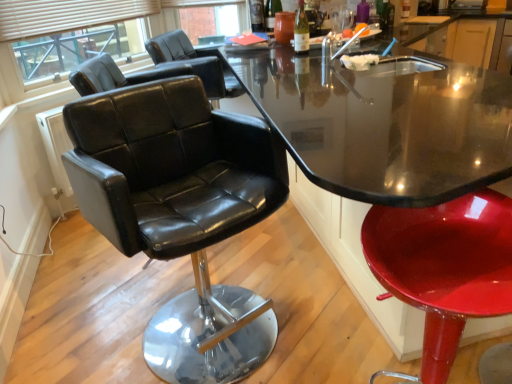
Image resolution: width=512 pixels, height=384 pixels. I want to click on glossy black table at center, so click(378, 148).

Locate an element on the screen. The image size is (512, 384). glossy red stool at lower right, which is counted as the third chair, starting from the back is located at coordinates (444, 267).

Locate an element on the screen. Image resolution: width=512 pixels, height=384 pixels. black leather chair at center, which ranks as the first chair in back-to-front order is located at coordinates (170, 47).

What do you see at coordinates (301, 30) in the screenshot? The width and height of the screenshot is (512, 384). I see `white glass bottle at upper center` at bounding box center [301, 30].

You are a GUI agent. You are given a task and a screenshot of the screen. Output one action in this format:
    pyautogui.click(x=<x>, y=<y>)
    Task: Click on the black leather chairs at upper left
    
    Given the screenshot: What is the action you would take?
    pyautogui.click(x=73, y=27)

At what (x,y) coordinates should I click in order to perform the action: click on glossy black table at center. Please return your answer as a coordinate pair (x, y). Looking at the image, I should click on (378, 148).

Locate an element on the screen. This screenshot has width=512, height=384. bay window above the black leather chair at center, which ranks as the first chair in back-to-front order (from the image's perspective) is located at coordinates (73, 27).

Is black leather chairs at upper left not close to black leather chair at center, which ranks as the first chair in back-to-front order?

No, black leather chairs at upper left is not far away from black leather chair at center, which ranks as the first chair in back-to-front order.

Is black leather chairs at upper left facing away from black leather chair at center, which ranks as the first chair in back-to-front order?

No.

Between point (6, 34) and point (165, 37), which one is positioned in front?

Positioned in front is point (6, 34).

Would you consider glossy black table at center to be distant from glossy red stool at lower right, the 1th chair when ordered from front to back?

Yes, glossy black table at center and glossy red stool at lower right, the 1th chair when ordered from front to back, are quite far apart.

Based on the photo, can you tell me how much glossy black table at center and glossy red stool at lower right, which is counted as the third chair, starting from the back, differ in facing direction?

They differ by 92.5 degrees in their facing directions.

Image resolution: width=512 pixels, height=384 pixels. Identify the location of table that is on the right side of glossy red stool at lower right, which is counted as the third chair, starting from the back. (378, 148).

Considering the relative positions of glossy black table at center and glossy red stool at lower right, which is counted as the third chair, starting from the back, in the image provided, is glossy black table at center to the left of glossy red stool at lower right, which is counted as the third chair, starting from the back, from the viewer's perspective?

No.

Is white glass bottle at upper center spatially inside glossy black table at center, or outside of it?

white glass bottle at upper center lies outside glossy black table at center.

Measure the distance from white glass bottle at upper center to glossy black table at center.

white glass bottle at upper center is 25.47 inches from glossy black table at center.

Is point (298, 2) closer to camera compared to point (337, 127)?

No.

How many degrees apart are the facing directions of black leather chair at center, placed as the third chair when sorted from front to back, and black leather chairs at upper left?

There is a 23.5-degree angle between the facing directions of black leather chair at center, placed as the third chair when sorted from front to back, and black leather chairs at upper left.

Considering the relative sizes of black leather chair at center, which ranks as the first chair in back-to-front order, and black leather chairs at upper left in the image provided, is black leather chair at center, which ranks as the first chair in back-to-front order, thinner than black leather chairs at upper left?

No, black leather chair at center, which ranks as the first chair in back-to-front order, is not thinner than black leather chairs at upper left.

Is black leather chairs at upper left at the back of black leather chair at center, which ranks as the first chair in back-to-front order?

Yes, black leather chair at center, which ranks as the first chair in back-to-front order, is positioned with its back facing black leather chairs at upper left.

From a real-world perspective, relative to black leather chairs at upper left, is black leather chair at center, which ranks as the first chair in back-to-front order, vertically above or below?

black leather chair at center, which ranks as the first chair in back-to-front order, is situated lower than black leather chairs at upper left in the real world.

Does black leather chair at center, which ranks as the first chair in back-to-front order, contain glossy black table at center?

Actually, glossy black table at center is outside black leather chair at center, which ranks as the first chair in back-to-front order.

Could you tell me if black leather chair at center, placed as the third chair when sorted from front to back, is facing glossy black table at center?

No.

Is black leather chair at center, which ranks as the first chair in back-to-front order, taller or shorter than glossy black table at center?

black leather chair at center, which ranks as the first chair in back-to-front order, is shorter than glossy black table at center.

Considering their positions, is black leather chair at center, which ranks as the first chair in back-to-front order, located in front of or behind glossy black table at center?

Visually, black leather chair at center, which ranks as the first chair in back-to-front order, is located behind glossy black table at center.

Considering their positions, is glossy black table at center located in front of or behind black leather chair at left, which is counted as the second chair, starting from the back?

glossy black table at center is positioned closer to the viewer than black leather chair at left, which is counted as the second chair, starting from the back.

Based on the photo, what's the angular difference between glossy black table at center and black leather chair at left, which is counted as the second chair, starting from the back,'s facing directions?

glossy black table at center and black leather chair at left, which is counted as the second chair, starting from the back, are facing 69.1 degrees away from each other.

Is glossy black table at center positioned with its back to black leather chair at left, which is counted as the second chair, starting from the back?

Yes, glossy black table at center is facing away from black leather chair at left, which is counted as the second chair, starting from the back.

Is glossy black table at center touching black leather chair at left, which is the second chair from front to back?

They are not placed beside each other.

Is point (168, 53) closer to viewer compared to point (178, 188)?

That is False.

Considering the relative positions of black leather chair at center, placed as the third chair when sorted from front to back, and black leather chair at left, which is the second chair from front to back, in the image provided, is black leather chair at center, placed as the third chair when sorted from front to back, in front of black leather chair at left, which is the second chair from front to back,?

No, black leather chair at center, placed as the third chair when sorted from front to back, is further to the viewer.

Does black leather chair at center, placed as the third chair when sorted from front to back, turn towards black leather chair at left, which is the second chair from front to back?

No.

Is black leather chair at center, placed as the third chair when sorted from front to back, not near black leather chair at left, which is counted as the second chair, starting from the back?

Yes, black leather chair at center, placed as the third chair when sorted from front to back, and black leather chair at left, which is counted as the second chair, starting from the back, are located far from each other.

At what (x,y) coordinates should I click in order to perform the action: click on bay window above the black leather chair at center, which ranks as the first chair in back-to-front order (from the image's perspective). Please return your answer as a coordinate pair (x, y). Looking at the image, I should click on pos(73,27).

Locate an element on the screen. This screenshot has width=512, height=384. table that is on the right side of glossy red stool at lower right, the 1th chair when ordered from front to back is located at coordinates (378, 148).

Estimate the real-world distances between objects in this image. Which object is closer to black leather chairs at upper left, glossy red stool at lower right, which is counted as the third chair, starting from the back, or white glass bottle at upper center?

white glass bottle at upper center lies closer to black leather chairs at upper left than the other object.

Considering their positions, is white glass bottle at upper center positioned closer to black leather chair at center, placed as the third chair when sorted from front to back, than black leather chairs at upper left?

black leather chairs at upper left lies closer to black leather chair at center, placed as the third chair when sorted from front to back, than the other object.

Considering their positions, is glossy red stool at lower right, the 1th chair when ordered from front to back, positioned further to black leather chair at center, placed as the third chair when sorted from front to back, than white glass bottle at upper center?

Based on the image, glossy red stool at lower right, the 1th chair when ordered from front to back, appears to be further to black leather chair at center, placed as the third chair when sorted from front to back.

Looking at the image, which one is located closer to black leather chair at left, which is the second chair from front to back, white glass bottle at upper center or black leather chair at center, placed as the third chair when sorted from front to back?

black leather chair at center, placed as the third chair when sorted from front to back, is positioned closer to the anchor black leather chair at left, which is the second chair from front to back.

Estimate the real-world distances between objects in this image. Which object is closer to black leather chairs at upper left, black leather chair at left, which is the second chair from front to back, or glossy black table at center?

glossy black table at center lies closer to black leather chairs at upper left than the other object.

Considering their positions, is black leather chairs at upper left positioned closer to white glass bottle at upper center than glossy red stool at lower right, the 1th chair when ordered from front to back?

Among the two, black leather chairs at upper left is located nearer to white glass bottle at upper center.

In the scene shown: Estimate the real-world distances between objects in this image. Which object is closer to black leather chairs at upper left, glossy red stool at lower right, the 1th chair when ordered from front to back, or black leather chair at left, which is the second chair from front to back?

The object closer to black leather chairs at upper left is black leather chair at left, which is the second chair from front to back.

From the image, which object appears to be nearer to glossy red stool at lower right, the 1th chair when ordered from front to back, black leather chair at left, which is the second chair from front to back, or black leather chairs at upper left?

black leather chair at left, which is the second chair from front to back.

Locate an element on the screen. This screenshot has height=384, width=512. chair between glossy red stool at lower right, the 1th chair when ordered from front to back, and black leather chair at center, placed as the third chair when sorted from front to back, in the front-back direction is located at coordinates (181, 212).

Where is `table between glossy red stool at lower right, which is counted as the third chair, starting from the back, and white glass bottle at upper center in the front-back direction`? The image size is (512, 384). table between glossy red stool at lower right, which is counted as the third chair, starting from the back, and white glass bottle at upper center in the front-back direction is located at coordinates point(378,148).

Find the location of `bay window between black leather chair at left, which is counted as the second chair, starting from the back, and white glass bottle at upper center, along the z-axis`. bay window between black leather chair at left, which is counted as the second chair, starting from the back, and white glass bottle at upper center, along the z-axis is located at coordinates (73, 27).

This screenshot has width=512, height=384. In order to click on chair between glossy red stool at lower right, which is counted as the third chair, starting from the back, and white glass bottle at upper center from front to back in this screenshot , I will do `click(181, 212)`.